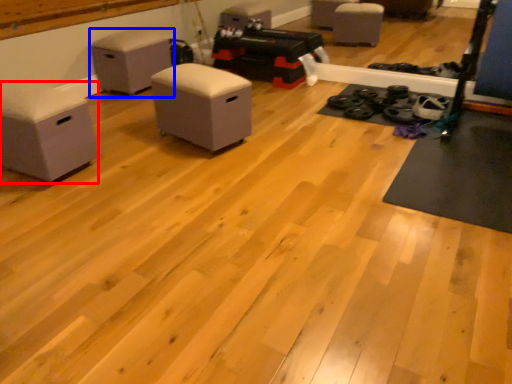
Question: Which of the following is the farthest to the observer, furniture (highlighted by a red box) or furniture (highlighted by a blue box)?

Choices:
 (A) furniture
 (B) furniture

Answer: (B)